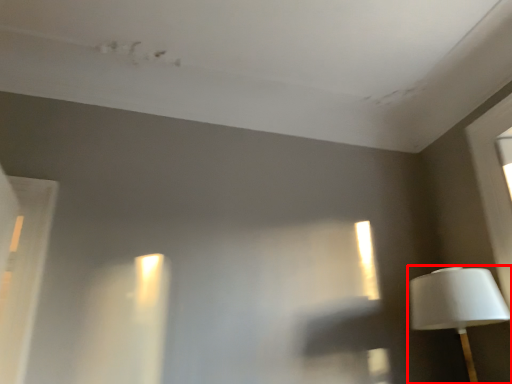
Question: From the image's perspective, what is the correct spatial relationship of lamp (annotated by the red box) in relation to window?

Choices:
 (A) below
 (B) above

Answer: (A)